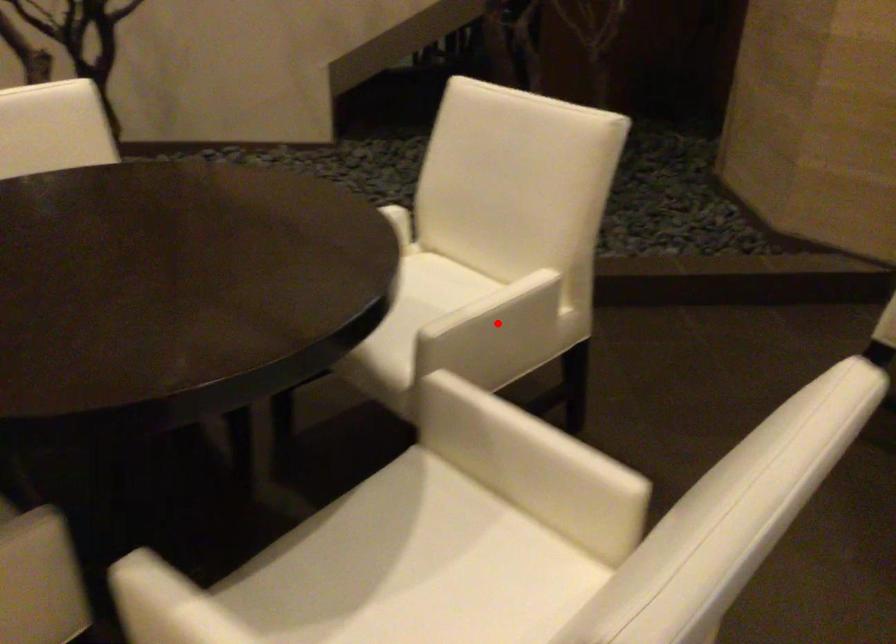
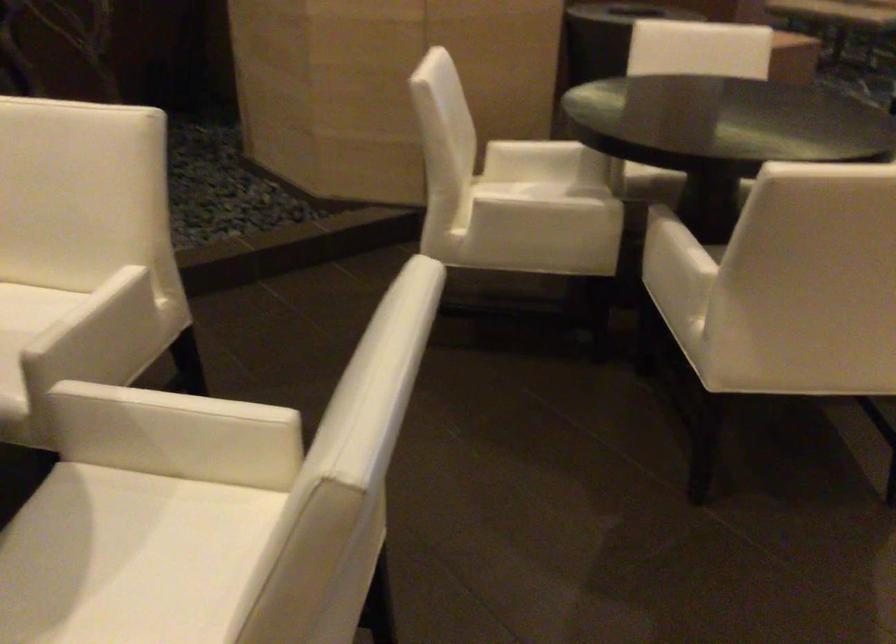
In the second image, find the point that corresponds to the highlighted location in the first image.

(102, 328)